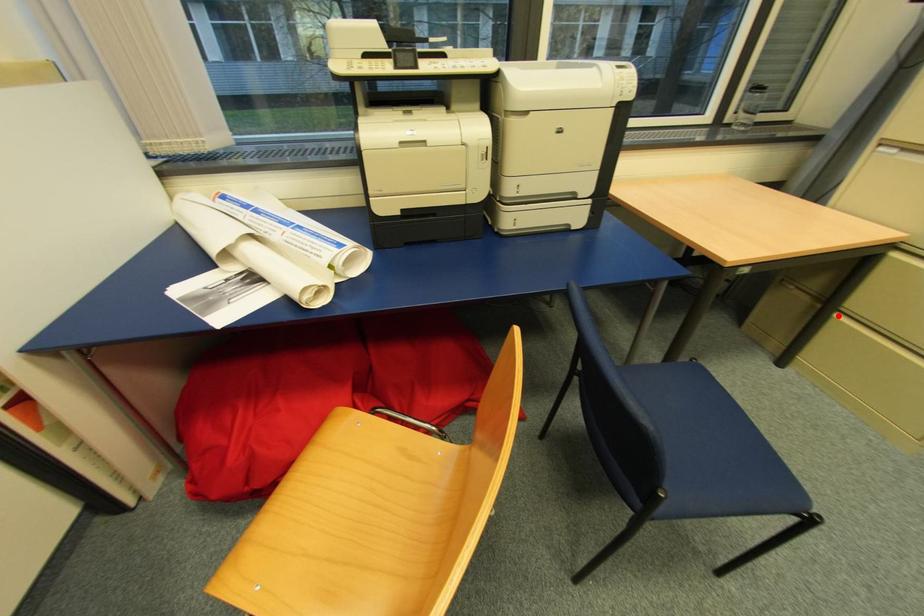
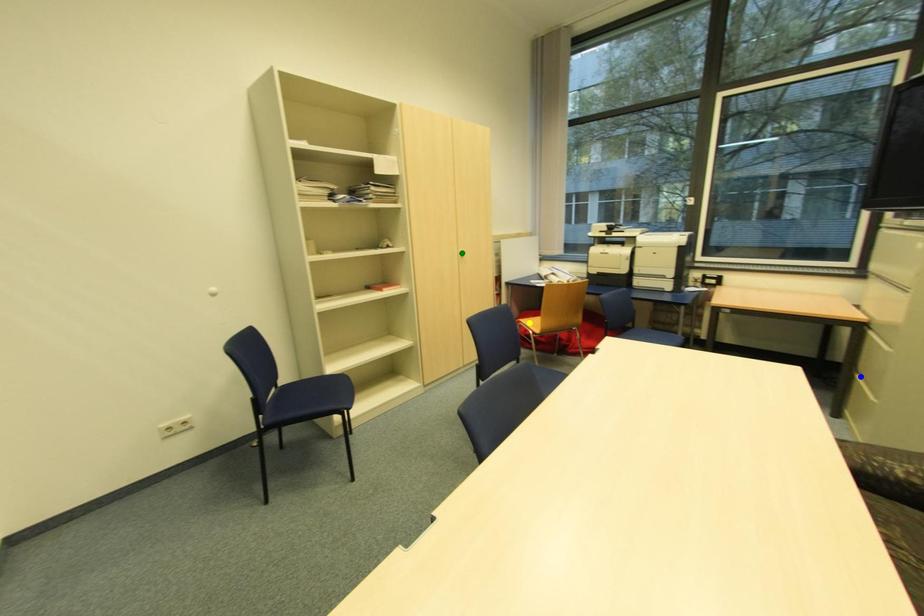
Question: I am providing you with two images of the same scene from different viewpoints. A red point is marked on the first image. You are given multiple points on the second image. Which spot in image 2 lines up with the point in image 1?

Choices:
 (A) yellow point
 (B) blue point
 (C) green point

Answer: (B)